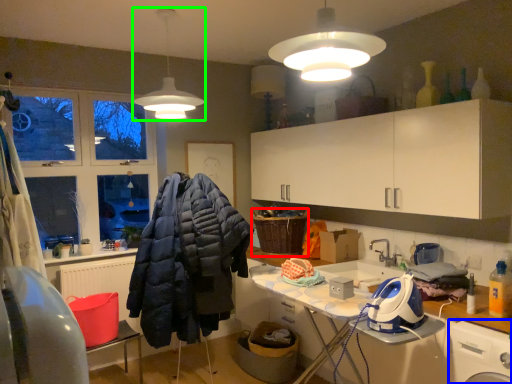
Question: Which is nearer to the basket (highlighted by a red box)? washing machine (highlighted by a blue box) or lamp (highlighted by a green box).

Choices:
 (A) washing machine
 (B) lamp

Answer: (B)